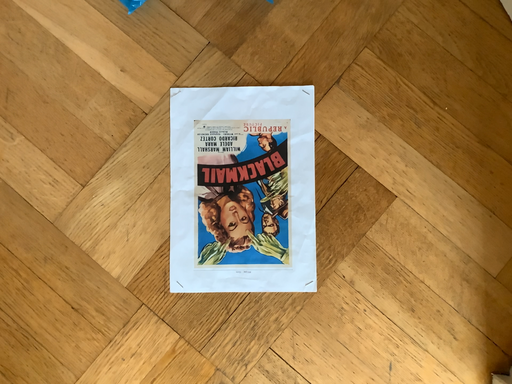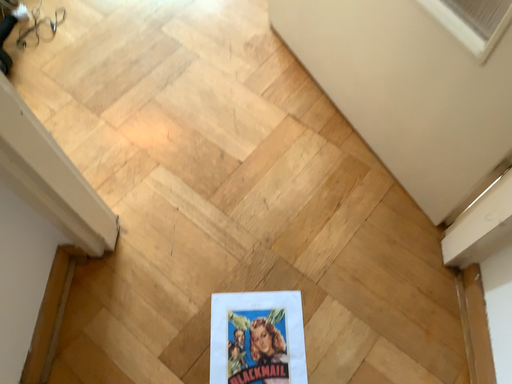
Question: Which way did the camera rotate in the video?

Choices:
 (A) rotated downward
 (B) rotated upward

Answer: (B)